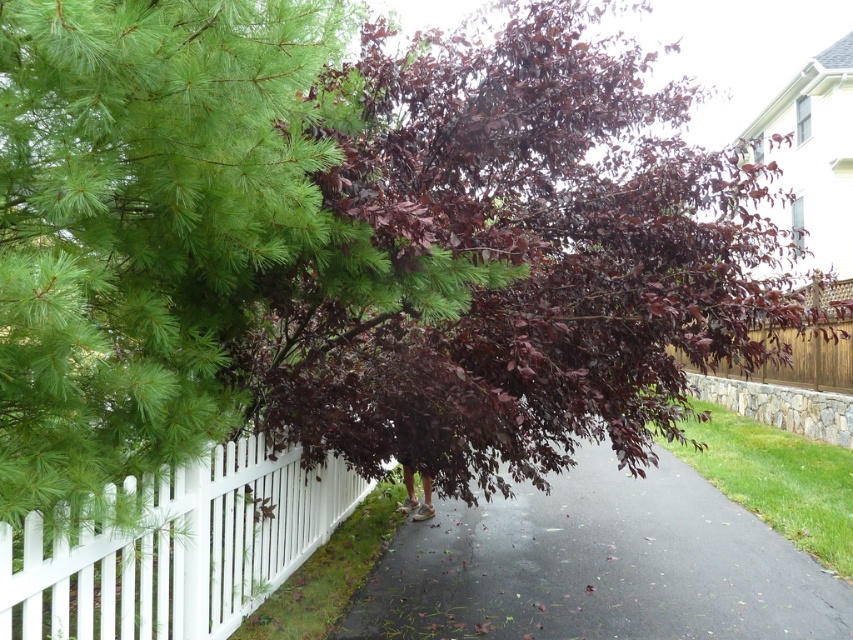
You are standing at the point indicated by point [523,257] in the suburban scene. What is the nearest tree to your current position?

The nearest tree to point [523,257] is the dark purple leafy tree at center.

You are standing at the starting point of the pathway and want to reach the end. There are two points marked on the path, point (x=282, y=356) and point (x=670, y=534). Which point should you pass first while moving towards the end of the pathway?

You should pass point (x=282, y=356) first because it is in front of point (x=670, y=534) along the pathway.

You are a delivery person with a cart that is 3 feet wide. You need to navigate through the pathway between the black asphalt pavement at center and the white wooden fence at center. Can your cart fit through this space?

The distance between the black asphalt pavement at center and the white wooden fence at center is 9.05 feet. Since your cart is only 3 feet wide, it can easily fit through the 9.05 feet space between them.